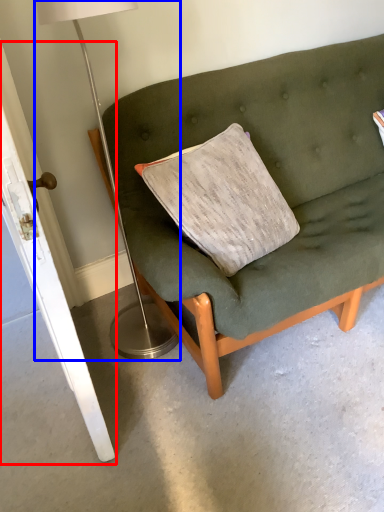
Question: Which of the following is the farthest to the observer, door (highlighted by a red box) or table lamp (highlighted by a blue box)?

Choices:
 (A) door
 (B) table lamp

Answer: (B)